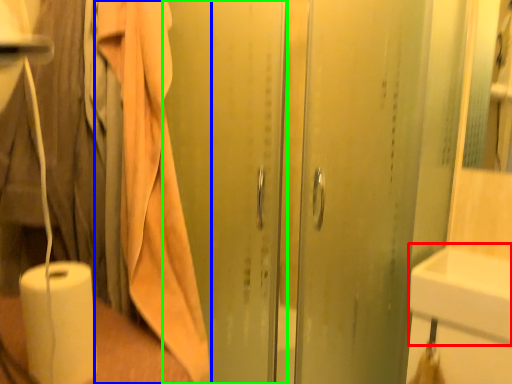
Question: Which is nearer to the sink (highlighted by a red box)? bath towel (highlighted by a blue box) or screen door (highlighted by a green box).

Choices:
 (A) bath towel
 (B) screen door

Answer: (B)